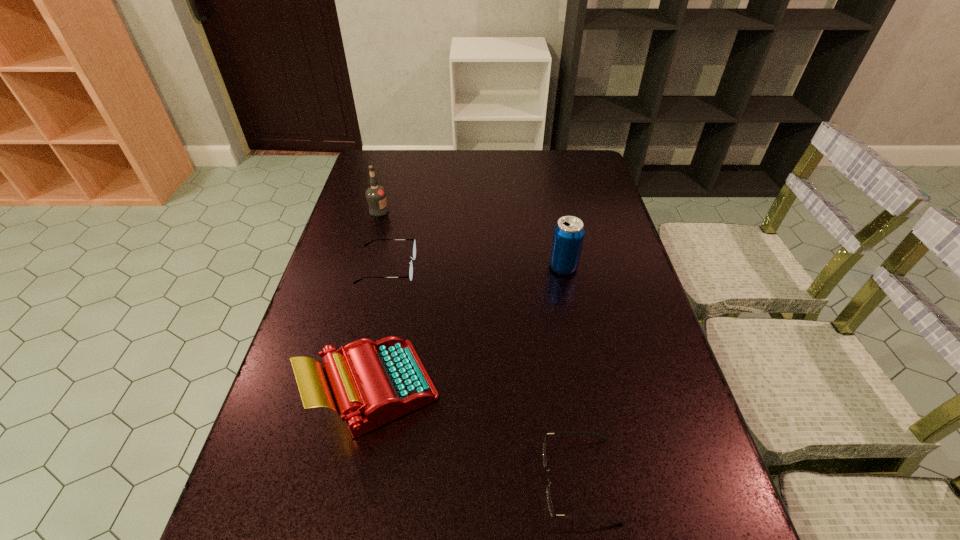
What are the coordinates of `free space located on the lenses of the second shortest object` in the screenshot? It's located at (519, 267).

This screenshot has width=960, height=540. In order to click on vacant space located 0.140m on the front-facing side of the right spectacles in this screenshot , I will do `click(468, 480)`.

Find the location of a particular element. The image size is (960, 540). vacant space located on the front-facing side of the right spectacles is located at coordinates (516, 480).

Image resolution: width=960 pixels, height=540 pixels. Find the location of `blank area located on the front-facing side of the right spectacles`. blank area located on the front-facing side of the right spectacles is located at coordinates (506, 480).

You are a GUI agent. You are given a task and a screenshot of the screen. Output one action in this format:
    pyautogui.click(x=<x>, y=<y>)
    Task: Click on the vodka that is at the left edge
    This screenshot has height=540, width=960.
    Given the screenshot: What is the action you would take?
    pyautogui.click(x=376, y=195)

Image resolution: width=960 pixels, height=540 pixels. Find the location of `typewriter that is at the left edge`. typewriter that is at the left edge is located at coordinates (368, 383).

Find the location of a particular element. spectacles located in the left edge section of the desktop is located at coordinates (413, 257).

You are a GUI agent. You are given a task and a screenshot of the screen. Output one action in this format:
    pyautogui.click(x=<x>, y=<y>)
    Task: Click on the object positioned at the right edge
    The width and height of the screenshot is (960, 540).
    Given the screenshot: What is the action you would take?
    pyautogui.click(x=568, y=235)

In the image, there is a desktop. Identify the location of vacant space at the far edge. (510, 149).

The height and width of the screenshot is (540, 960). Identify the location of vacant position at the left edge of the desktop. (386, 226).